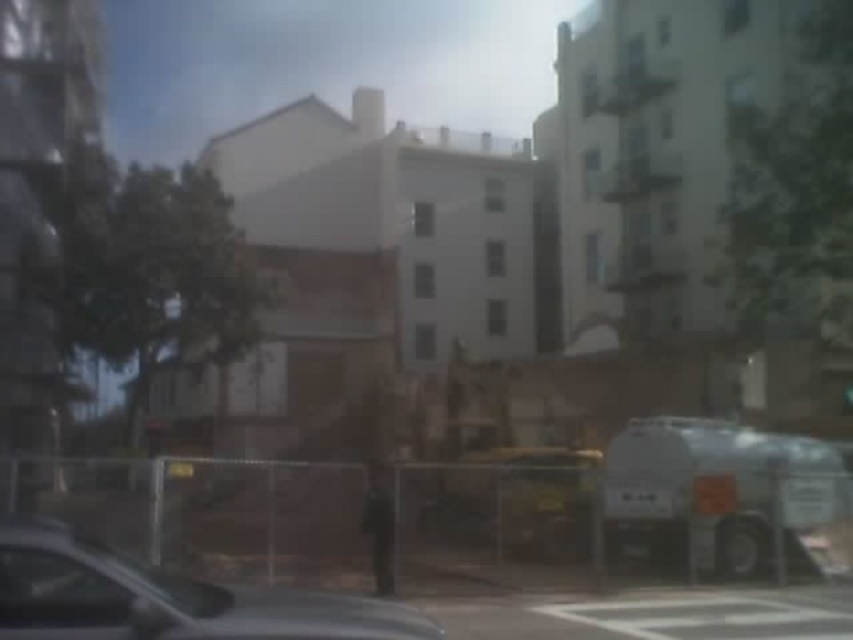
Question: Can you confirm if metallic silver car at lower left is bigger than white matte truck at lower right?

Choices:
 (A) no
 (B) yes

Answer: (A)

Question: Among these points, which one is nearest to the camera?

Choices:
 (A) (718, 564)
 (B) (207, 604)

Answer: (B)

Question: Considering the relative positions of metallic silver car at lower left and white matte truck at lower right in the image provided, where is metallic silver car at lower left located with respect to white matte truck at lower right?

Choices:
 (A) right
 (B) left

Answer: (B)

Question: Is metallic silver car at lower left bigger than white matte truck at lower right?

Choices:
 (A) yes
 (B) no

Answer: (B)